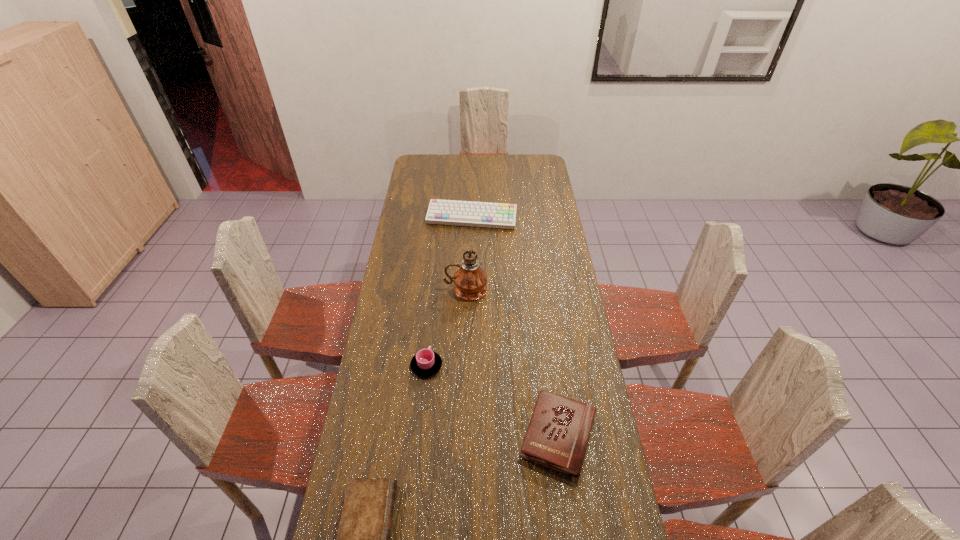
Locate an element on the screen. This screenshot has width=960, height=540. free point between the fourth nearest object and the second nearest object is located at coordinates (512, 362).

This screenshot has width=960, height=540. Identify the location of vacant space in between the oil lamp and the cup. (446, 327).

Where is `object that is the closest to the tallest object`? The width and height of the screenshot is (960, 540). object that is the closest to the tallest object is located at coordinates (425, 363).

Select which object is the fourth closest to the hardback book. Please provide its 2D coordinates. Your answer should be formatted as a tuple, i.e. [(x, y)], where the tuple contains the x and y coordinates of a point satisfying the conditions above.

[(445, 212)]

Where is `vacant space that satisfies the following two spatial constraints: 1. on the side with the handle of the third nearest object; 2. on the right side of the farthest object`? This screenshot has height=540, width=960. vacant space that satisfies the following two spatial constraints: 1. on the side with the handle of the third nearest object; 2. on the right side of the farthest object is located at coordinates (442, 218).

At what (x,y) coordinates should I click in order to perform the action: click on free space that satisfies the following two spatial constraints: 1. on the side with the handle of the cup; 2. on the left side of the farthest object. Please return your answer as a coordinate pair (x, y). Looking at the image, I should click on (442, 218).

The height and width of the screenshot is (540, 960). In order to click on vacant space that satisfies the following two spatial constraints: 1. on the front side of the farthest object; 2. on the right side of the fourth farthest object in this screenshot , I will do `click(467, 435)`.

Where is `vacant point that satisfies the following two spatial constraints: 1. on the side with the handle of the fourth nearest object; 2. on the left side of the cup`? vacant point that satisfies the following two spatial constraints: 1. on the side with the handle of the fourth nearest object; 2. on the left side of the cup is located at coordinates (435, 289).